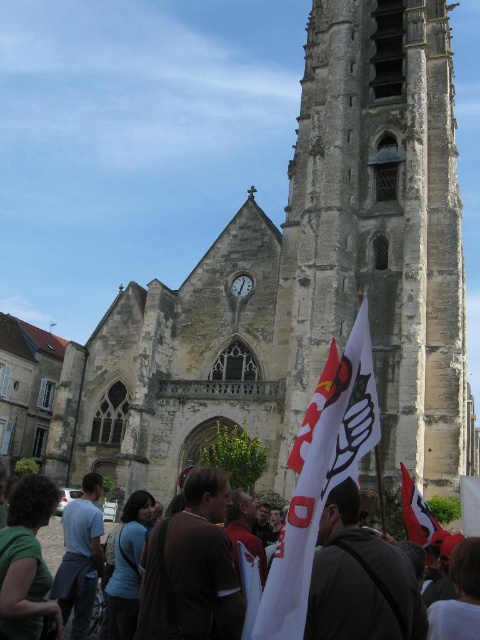
Question: From the image, what is the correct spatial relationship of green matte shirt at lower left in relation to blue cotton shirt at lower left?

Choices:
 (A) right
 (B) left

Answer: (A)

Question: Which point is farther to the camera?

Choices:
 (A) blue cotton shirt at lower left
 (B) red fabric flag at center
 (C) green matte shirt at lower left
 (D) brown leather jacket at center

Answer: (B)

Question: Which of the following is the farthest from the observer?

Choices:
 (A) brown fabric shirt at lower right
 (B) green matte shirt at lower left
 (C) red fabric flag at center

Answer: (C)

Question: Does green matte shirt at lower left lie in front of white cotton flags at lower center?

Choices:
 (A) no
 (B) yes

Answer: (B)

Question: Does brown leather jacket at center appear under green matte shirt at lower left?

Choices:
 (A) yes
 (B) no

Answer: (B)

Question: Which point is closer to the camera taking this photo?

Choices:
 (A) (99, 524)
 (B) (36, 572)
 (C) (448, 634)

Answer: (C)